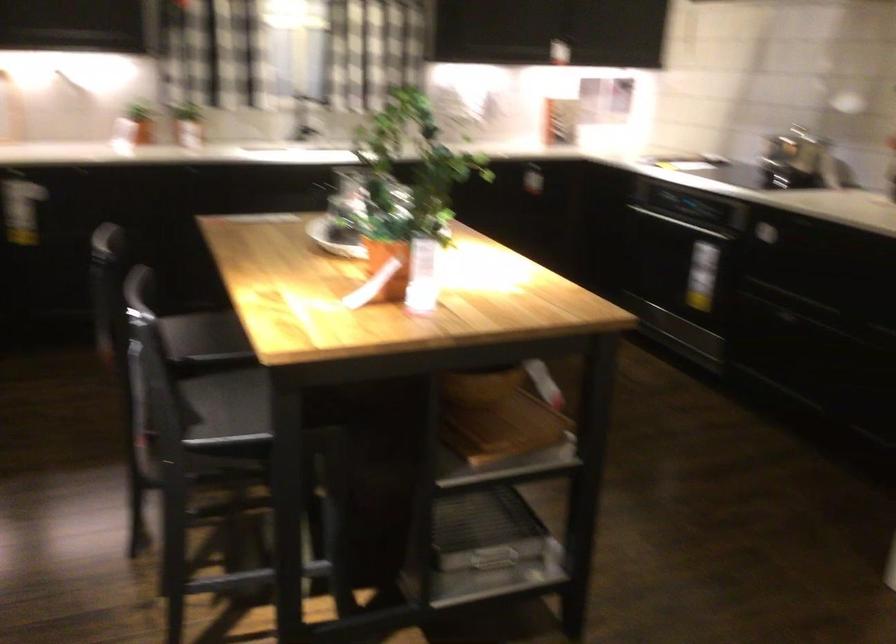
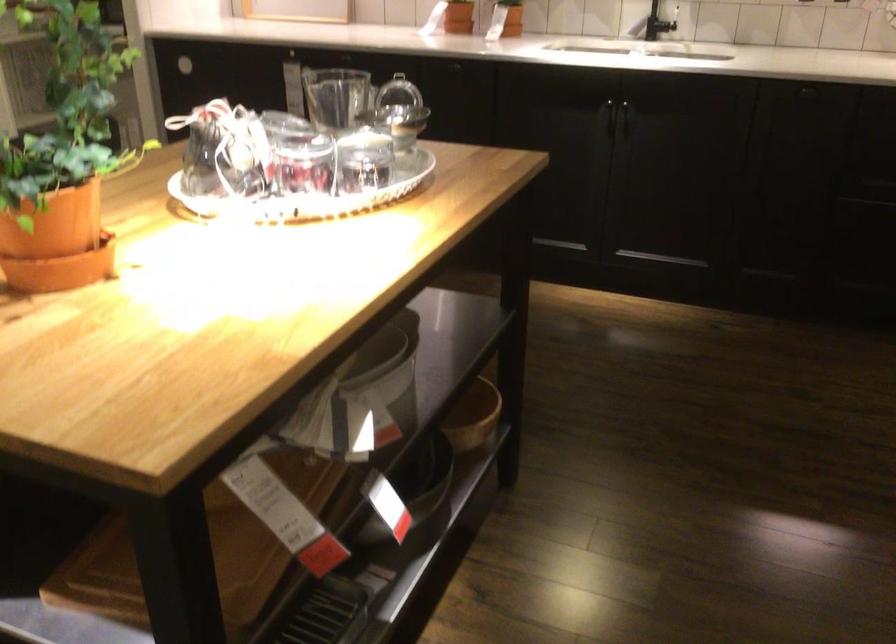
Where in the second image is the point corresponding to [418,261] from the first image?

(57, 239)